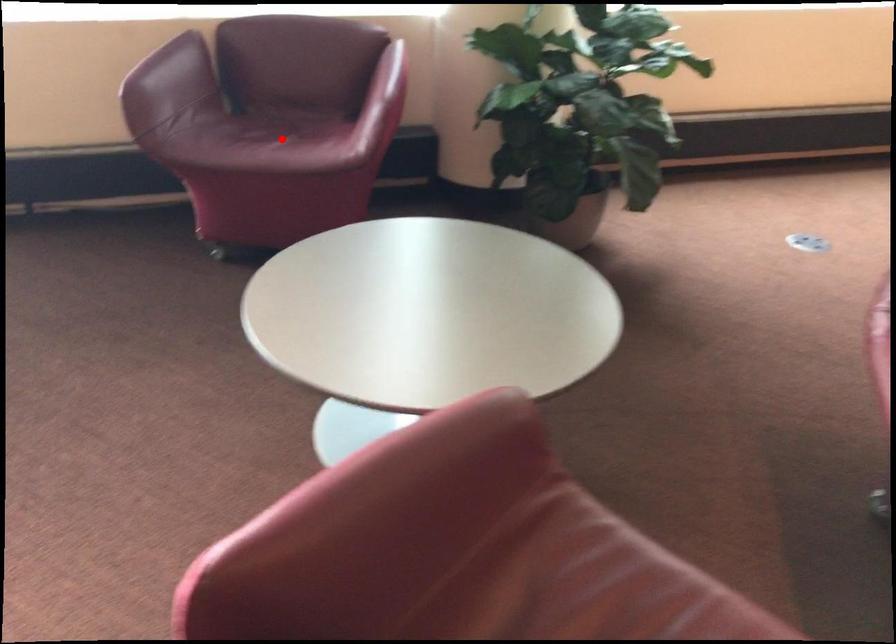
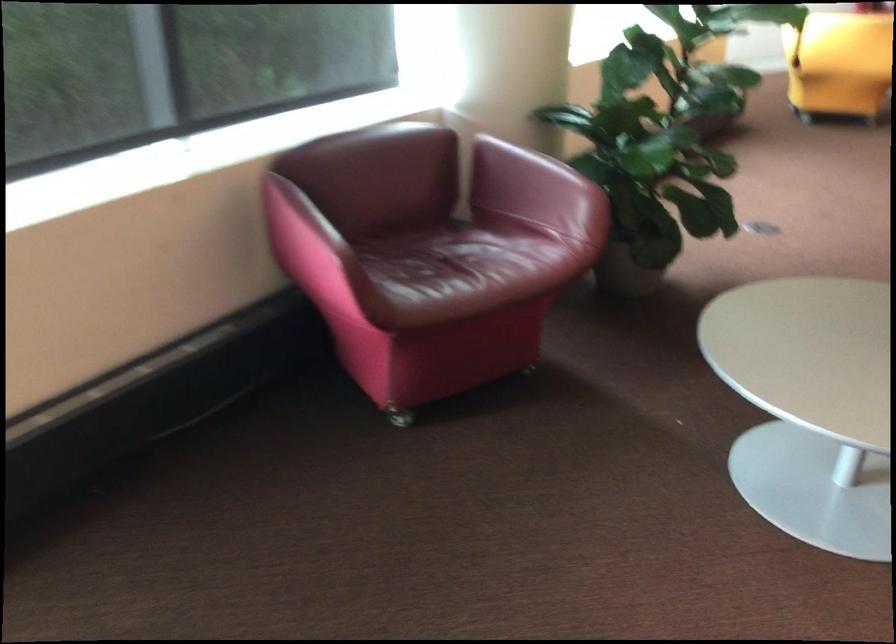
The point at the highlighted location is marked in the first image. Where is the corresponding point in the second image?

(466, 266)